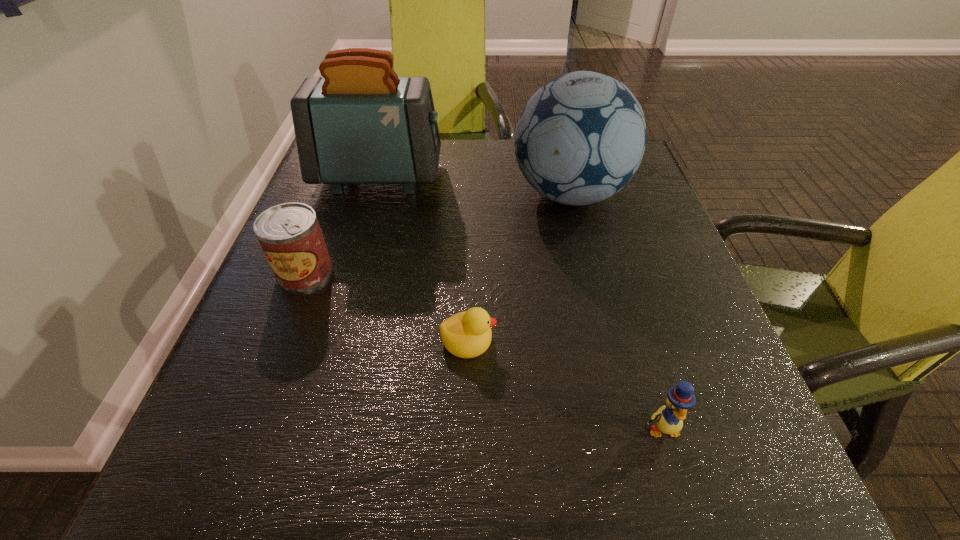
This screenshot has width=960, height=540. I want to click on free location located 0.200m on the side with brand of the soccer ball, so click(x=426, y=194).

Identify the location of free region located on the side with brand of the soccer ball. The height and width of the screenshot is (540, 960). (350, 194).

Find the location of a particular element. The image size is (960, 540). vacant space situated 0.070m on the front of the third farthest object is located at coordinates (286, 321).

You are a GUI agent. You are given a task and a screenshot of the screen. Output one action in this format:
    pyautogui.click(x=<x>, y=<y>)
    Task: Click on the vacant space positioned on the face of the farther duckling
    
    Given the screenshot: What is the action you would take?
    pyautogui.click(x=719, y=339)

This screenshot has height=540, width=960. I want to click on toaster positioned at the far edge, so click(359, 123).

Locate an element on the screen. This screenshot has width=960, height=540. soccer ball located in the far edge section of the desktop is located at coordinates (581, 137).

Find the location of a particular element. The height and width of the screenshot is (540, 960). toaster that is at the left edge is located at coordinates (359, 123).

You are a GUI agent. You are given a task and a screenshot of the screen. Output one action in this format:
    pyautogui.click(x=<x>, y=<y>)
    Task: Click on the can present at the left edge
    Image resolution: width=960 pixels, height=540 pixels.
    Given the screenshot: What is the action you would take?
    pyautogui.click(x=290, y=235)

You are a GUI agent. You are given a task and a screenshot of the screen. Output one action in this format:
    pyautogui.click(x=<x>, y=<y>)
    Task: Click on the soccer ball that is at the right edge
    
    Given the screenshot: What is the action you would take?
    pyautogui.click(x=581, y=137)

This screenshot has height=540, width=960. Find the location of `duckling that is positioned at the right edge`. duckling that is positioned at the right edge is located at coordinates [668, 419].